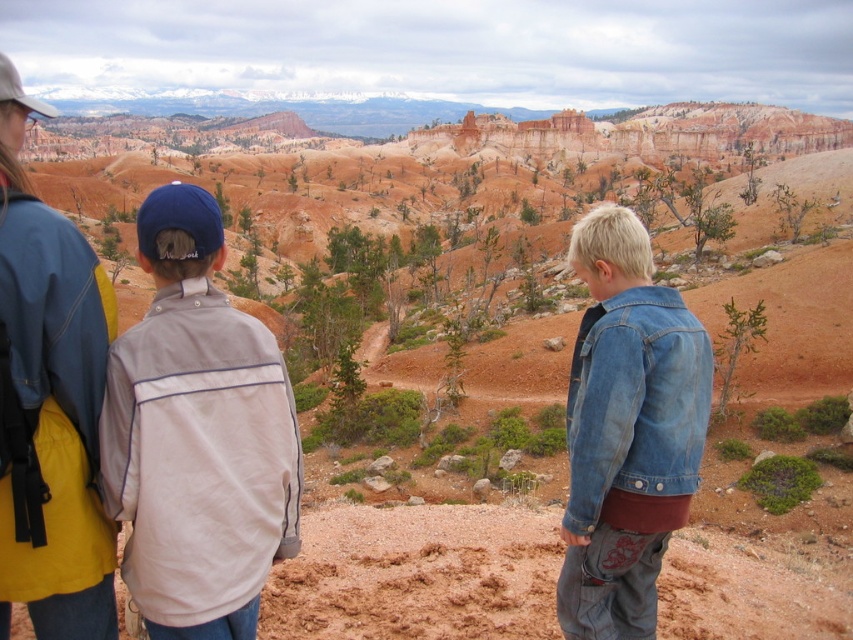
In the scene shown: Between light gray fabric jacket at center left and denim jacket at lower right, which one is positioned higher?

Positioned higher is light gray fabric jacket at center left.

Is light gray fabric jacket at center left thinner than denim jacket at lower right?

No, light gray fabric jacket at center left is not thinner than denim jacket at lower right.

Is point (271, 392) positioned before point (579, 497)?

Yes, point (271, 392) is in front of point (579, 497).

Image resolution: width=853 pixels, height=640 pixels. I want to click on light gray fabric jacket at center left, so click(x=196, y=435).

Is denim jacket at lower right wider than brushed metal jacket at upper left?

In fact, denim jacket at lower right might be narrower than brushed metal jacket at upper left.

Who is more distant from viewer, (640, 461) or (84, 360)?

Point (640, 461)

Identify the location of denim jacket at lower right. The height and width of the screenshot is (640, 853). (625, 429).

Between light gray fabric jacket at center left and brushed metal jacket at upper left, which one has less height?

light gray fabric jacket at center left

Between light gray fabric jacket at center left and brushed metal jacket at upper left, which one is positioned lower?

light gray fabric jacket at center left is lower down.

This screenshot has height=640, width=853. What do you see at coordinates (196, 435) in the screenshot?
I see `light gray fabric jacket at center left` at bounding box center [196, 435].

The image size is (853, 640). I want to click on light gray fabric jacket at center left, so click(x=196, y=435).